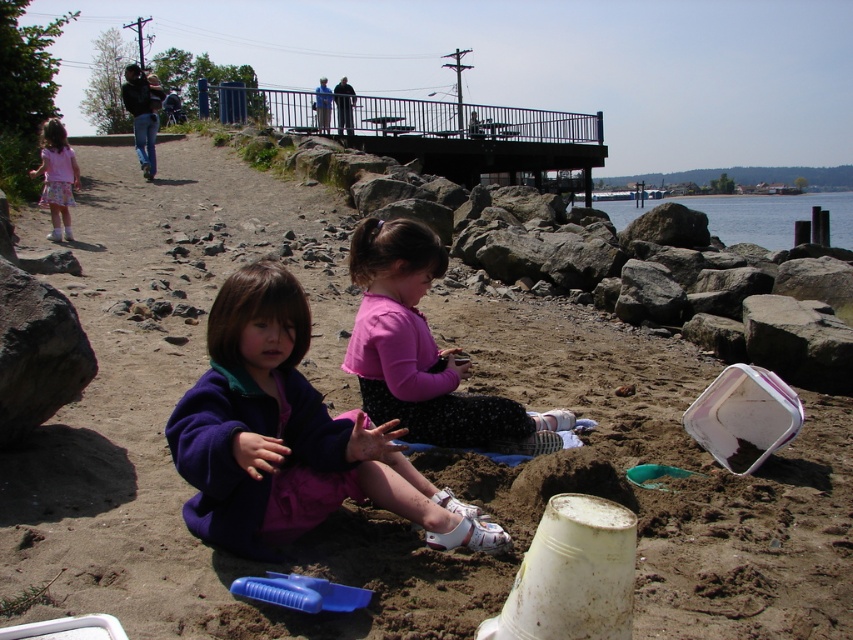
Question: Among these objects, which one is farthest from the camera?

Choices:
 (A) clear water at lower right
 (B) pink matte shirt at center
 (C) matte pink dress at left
 (D) purple fleece jacket at center

Answer: (A)

Question: Among these points, which one is nearest to the camera?

Choices:
 (A) (396, 326)
 (B) (44, 168)

Answer: (A)

Question: Does pink matte shirt at center appear on the right side of matte pink dress at left?

Choices:
 (A) no
 (B) yes

Answer: (B)

Question: In this image, where is pink matte shirt at center located relative to clear water at lower right?

Choices:
 (A) left
 (B) right

Answer: (A)

Question: Considering the real-world distances, which object is closest to the purple fleece jacket at center?

Choices:
 (A) clear water at lower right
 (B) matte pink dress at left

Answer: (B)

Question: Where is purple fleece jacket at center located in relation to pink matte shirt at center in the image?

Choices:
 (A) above
 (B) below

Answer: (B)